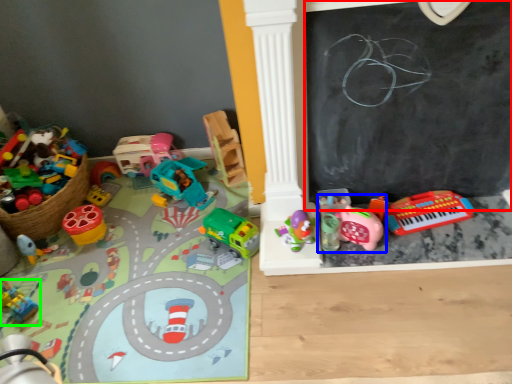
Question: Based on their relative distances, which object is nearer to bulletin board (highlighted by a red box)? Choose from toy (highlighted by a blue box) and toy (highlighted by a green box).

Choices:
 (A) toy
 (B) toy

Answer: (A)